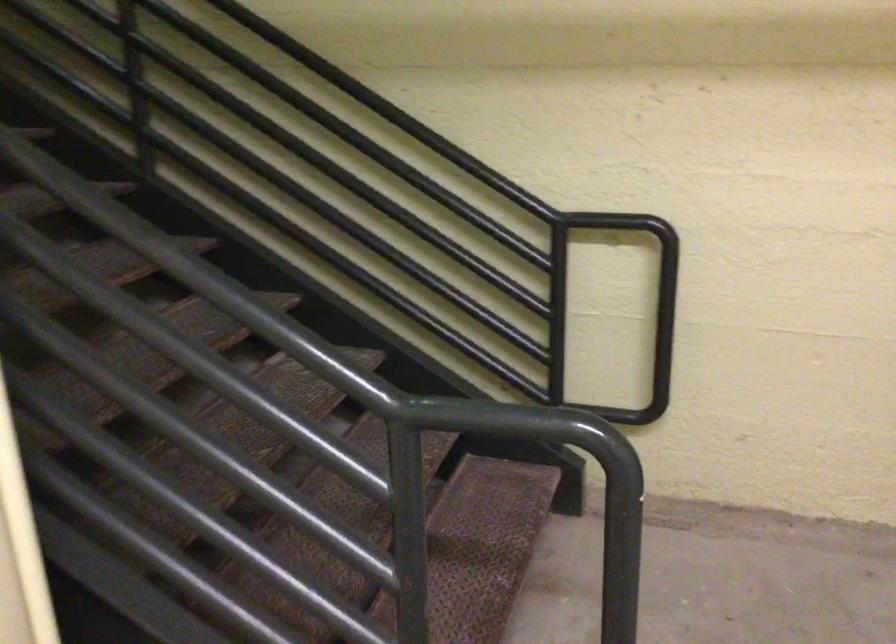
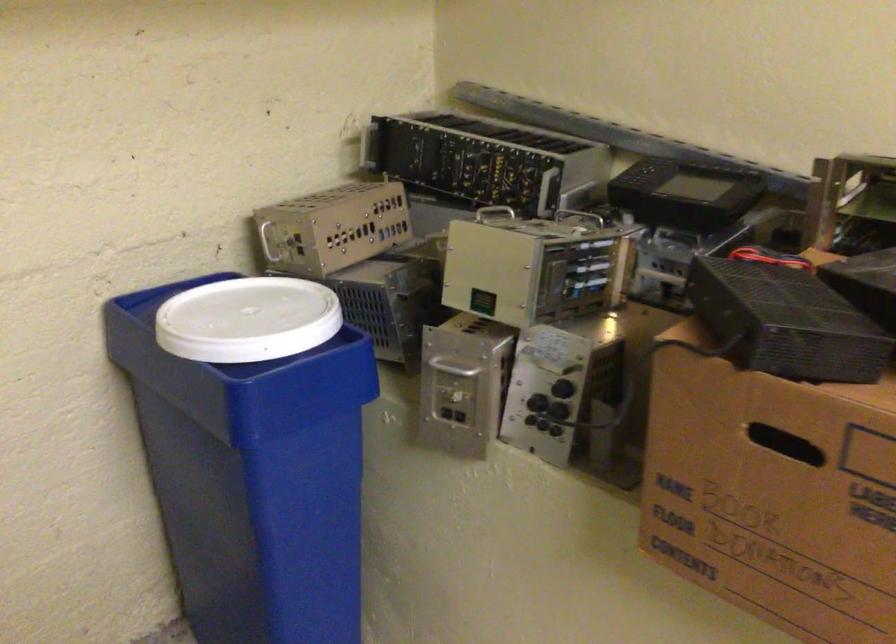
Question: How did the camera likely rotate?

Choices:
 (A) Left
 (B) Right
 (C) Up
 (D) Down

Answer: (B)